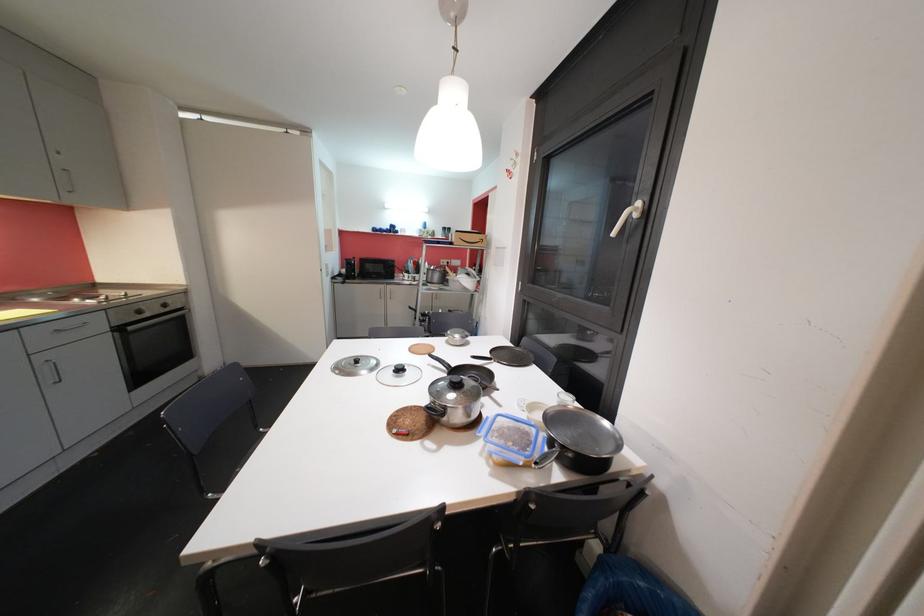
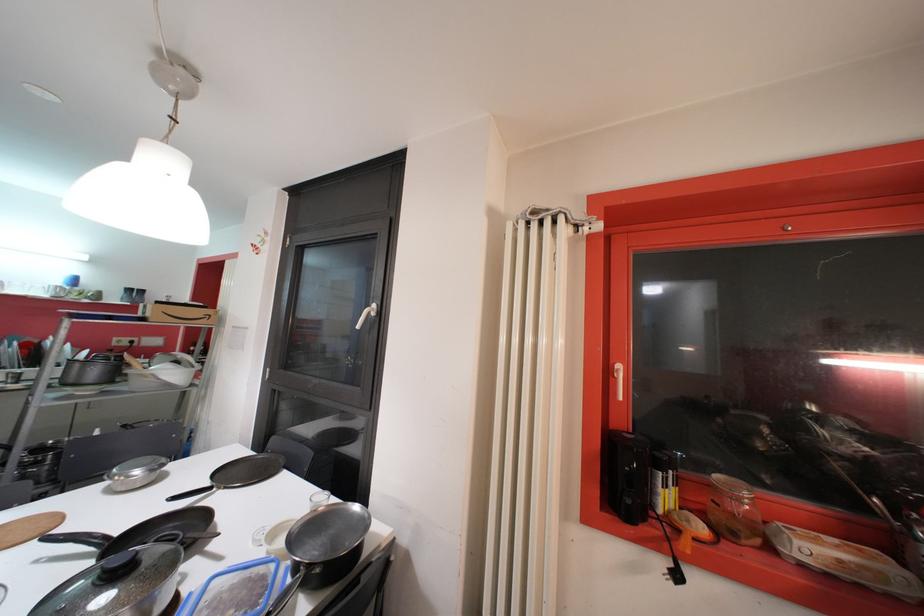
The point at (636, 217) is marked in the first image. Where is the corresponding point in the second image?

(373, 315)